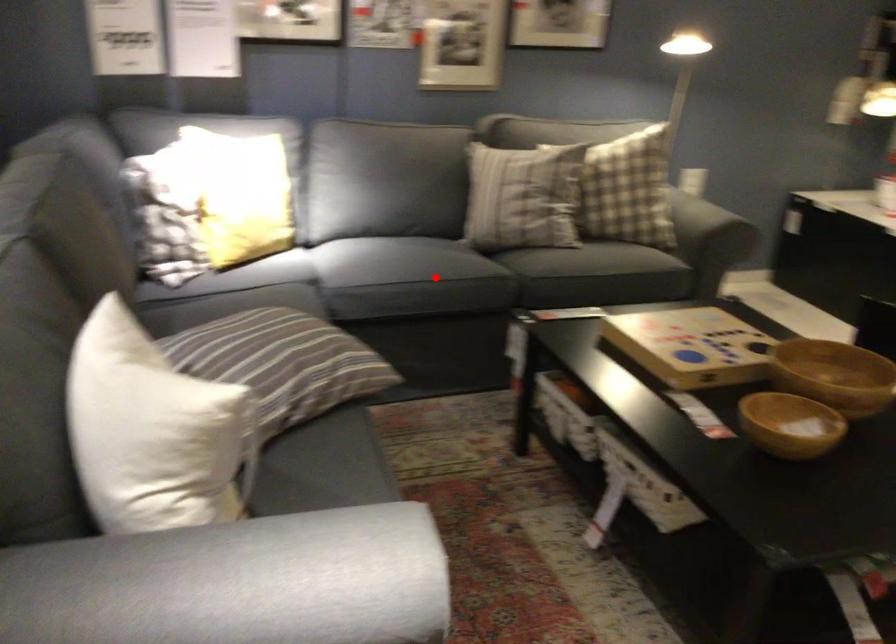
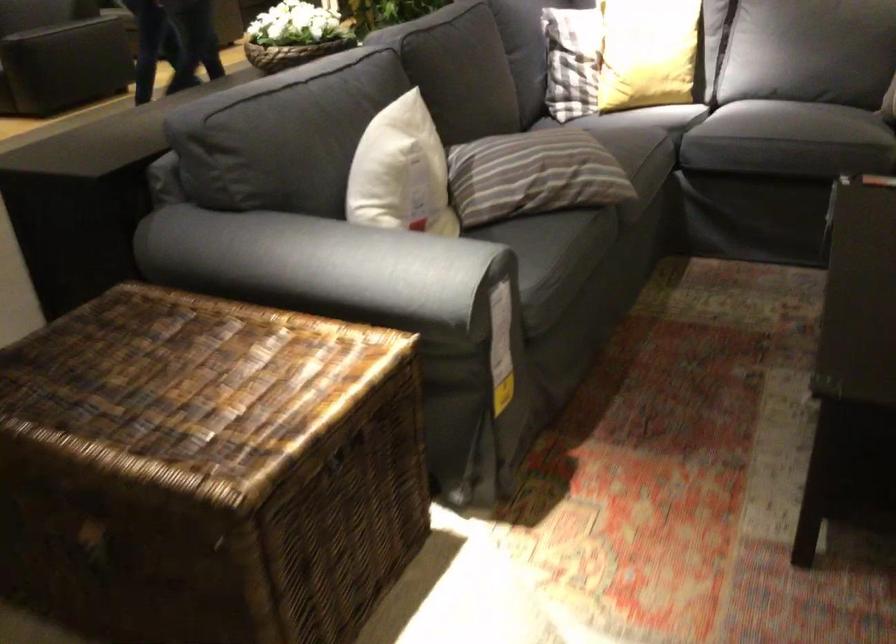
In the second image, find the point that corresponds to the highlighted location in the first image.

(768, 122)